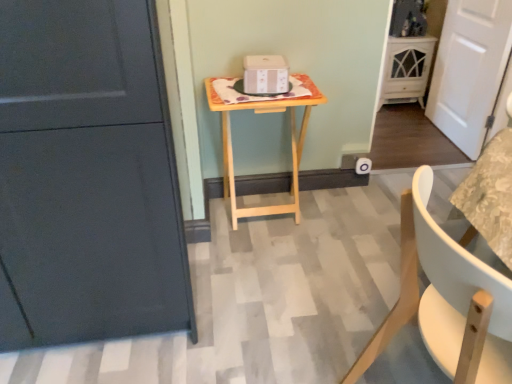
Question: From the image's perspective, is light wood/texture table at center under white wooden door at right?

Choices:
 (A) yes
 (B) no

Answer: (A)

Question: Is light wood/texture table at center shorter than white wooden door at right?

Choices:
 (A) no
 (B) yes

Answer: (B)

Question: Is white wooden door at right surrounded by light wood/texture table at center?

Choices:
 (A) yes
 (B) no

Answer: (B)

Question: Is light wood/texture table at center bigger than white wooden door at right?

Choices:
 (A) yes
 (B) no

Answer: (A)

Question: Is light wood/texture table at center far from white wooden door at right?

Choices:
 (A) yes
 (B) no

Answer: (A)

Question: Looking at the image, does white glossy cabinet at upper right seem bigger or smaller compared to white wooden door at right?

Choices:
 (A) small
 (B) big

Answer: (B)

Question: Is white glossy cabinet at upper right in front of or behind white wooden door at right in the image?

Choices:
 (A) behind
 (B) front

Answer: (A)

Question: Is white glossy cabinet at upper right inside or outside of white wooden door at right?

Choices:
 (A) outside
 (B) inside

Answer: (A)

Question: Visually, is white glossy cabinet at upper right positioned to the left or to the right of white wooden door at right?

Choices:
 (A) right
 (B) left

Answer: (B)

Question: From a real-world perspective, is white glossy cabinet at upper right physically located above or below light wood/texture table at center?

Choices:
 (A) below
 (B) above

Answer: (A)

Question: Is white glossy cabinet at upper right in front of or behind light wood/texture table at center in the image?

Choices:
 (A) behind
 (B) front

Answer: (A)

Question: Is point (385, 62) positioned closer to the camera than point (224, 112)?

Choices:
 (A) closer
 (B) farther

Answer: (B)

Question: Is white glossy cabinet at upper right bigger or smaller than light wood/texture table at center?

Choices:
 (A) small
 (B) big

Answer: (A)

Question: From a real-world perspective, is white wood chair at lower right above or below white wooden door at right?

Choices:
 (A) below
 (B) above

Answer: (A)

Question: In terms of width, does white wood chair at lower right look wider or thinner when compared to white wooden door at right?

Choices:
 (A) thin
 (B) wide

Answer: (B)